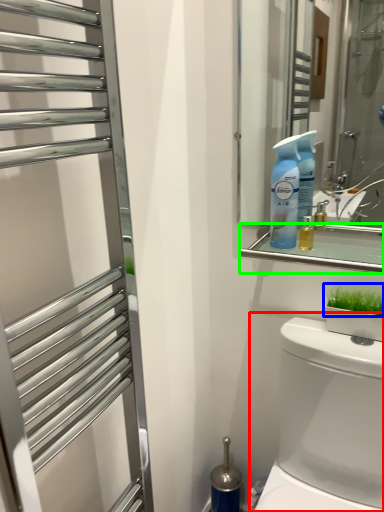
Question: Which object is positioned closest to toilet (highlighted by a red box)? Select from plant (highlighted by a blue box) and balustrade (highlighted by a green box).

Choices:
 (A) plant
 (B) balustrade

Answer: (A)